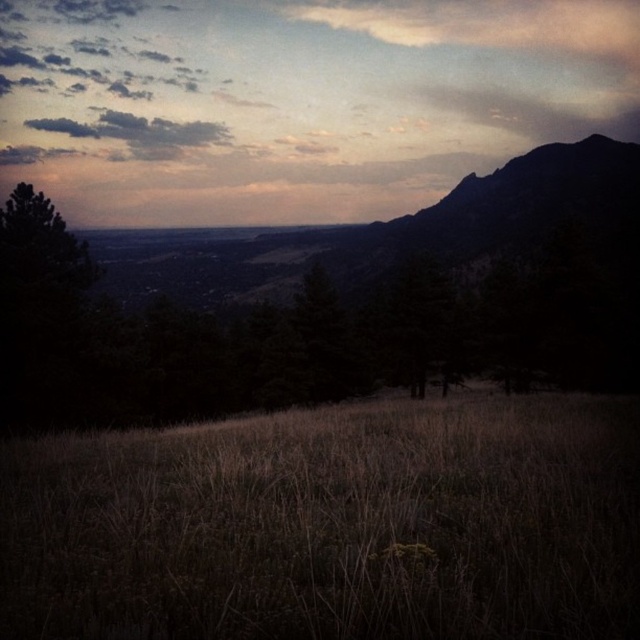
You are an astronomer observing the sky in the scene. You notice the matte sky at upper center and the dark gray cloud at upper left. Which object is positioned lower in the sky?

The matte sky at upper center is positioned lower in the sky than the dark gray cloud at upper left.

You are standing at the point marked as point (x=332, y=525) in the image. What type of vegetation do you see immediately around you?

The area around point (x=332, y=525) is covered with dry grass at center.